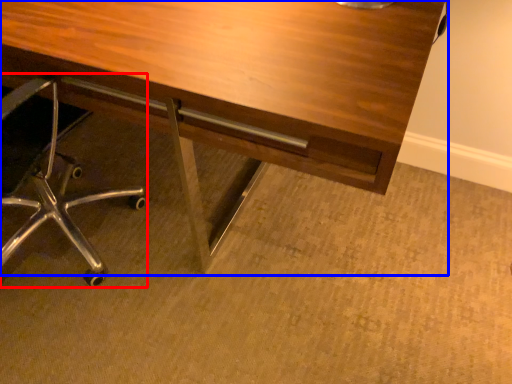
Question: Which of the following is the farthest to the observer, chair (highlighted by a red box) or desk (highlighted by a blue box)?

Choices:
 (A) chair
 (B) desk

Answer: (B)